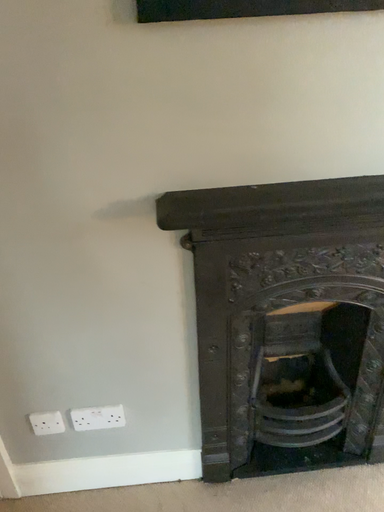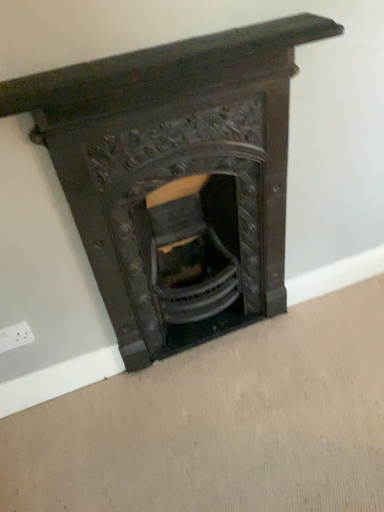
Question: How did the camera likely rotate when shooting the video?

Choices:
 (A) rotated left
 (B) rotated right

Answer: (B)